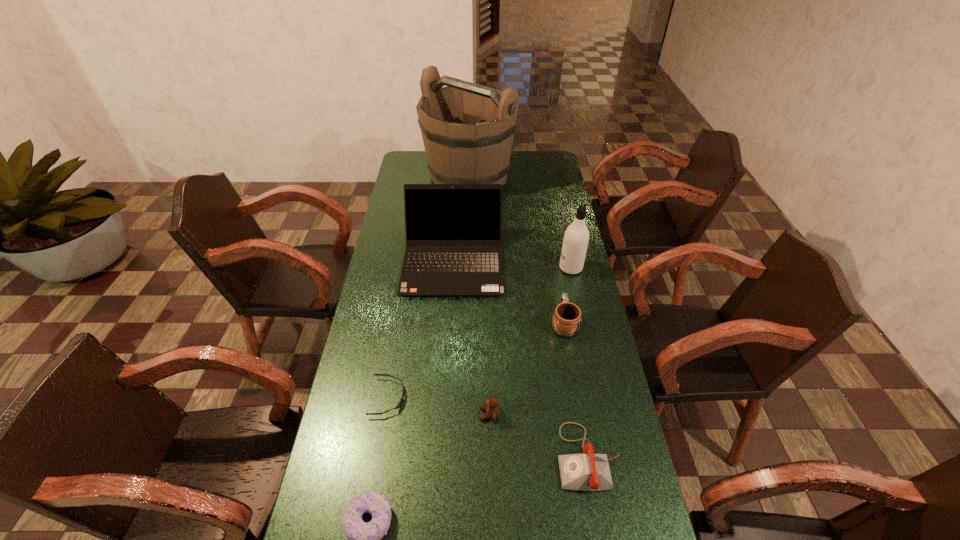
Where is `free space between the teddy bear and the shortest object`? free space between the teddy bear and the shortest object is located at coordinates (439, 406).

Identify which object is located as the seventh nearest to the second tallest object. Please provide its 2D coordinates. Your answer should be formatted as a tuple, i.e. [(x, y)], where the tuple contains the x and y coordinates of a point satisfying the conditions above.

[(363, 538)]

The width and height of the screenshot is (960, 540). I want to click on object that stands as the third closest to the doughnut, so click(x=588, y=471).